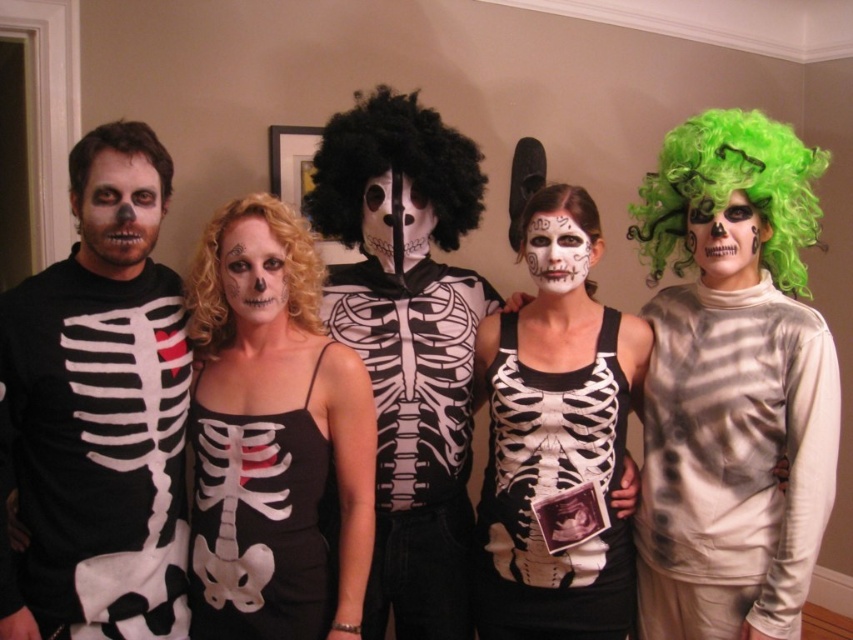
You are a photographer setting up for a Halloween group photo. You notice the matte black dress at center and the curly blonde wig at center. Which object is positioned lower in the scene?

The matte black dress at center is below the curly blonde wig at center, so it is positioned lower in the scene.

Consider the image. You are standing in front of the group of Halloween costume wearers. There are two points marked in the image. One is at coordinates point (375, 400) and the other is at point (579, 257). Which point is closer to you?

Point (375, 400) is closer to you because it is further to the viewer than point (579, 257).

You are standing 5 feet away from the camera. You want to take a photo of the matte black skeleton shirt at left. Is the shirt within your 5 feet range?

The matte black skeleton shirt at left is 4.76 feet from camera, so yes, it is within the 5 feet range.